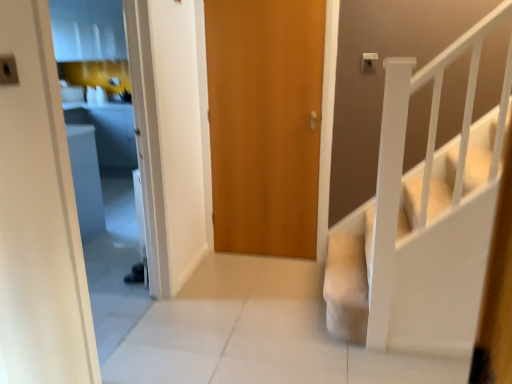
Question: Is white painted wood stairs at right taller or shorter than wooden door at center?

Choices:
 (A) short
 (B) tall

Answer: (A)

Question: Is white painted wood stairs at right inside or outside of wooden door at center?

Choices:
 (A) inside
 (B) outside

Answer: (B)

Question: From a real-world perspective, is white painted wood stairs at right physically located above or below wooden door at center?

Choices:
 (A) below
 (B) above

Answer: (A)

Question: Looking at their shapes, would you say wooden door at center is wider or thinner than white painted wood stairs at right?

Choices:
 (A) wide
 (B) thin

Answer: (B)

Question: From a real-world perspective, relative to white painted wood stairs at right, is wooden door at center vertically above or below?

Choices:
 (A) below
 (B) above

Answer: (B)

Question: From the image's perspective, relative to white painted wood stairs at right, is wooden door at center above or below?

Choices:
 (A) above
 (B) below

Answer: (A)

Question: Is wooden door at center in front of or behind white painted wood stairs at right in the image?

Choices:
 (A) behind
 (B) front

Answer: (A)